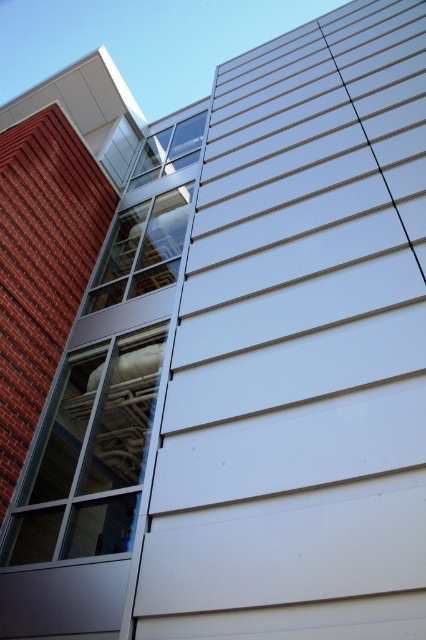
Between red brick siding at left and clear glass window at center-left, which one is positioned higher?

Positioned higher is clear glass window at center-left.

Between red brick siding at left and clear glass window at center-left, which one is positioned lower?

red brick siding at left is lower down.

Image resolution: width=426 pixels, height=640 pixels. In order to click on red brick siding at left in this screenshot , I will do `click(42, 266)`.

Image resolution: width=426 pixels, height=640 pixels. I want to click on red brick siding at left, so (42, 266).

Measure the distance from clear glass window at center-left to clear glass window at upper center.

clear glass window at center-left and clear glass window at upper center are 2.26 meters apart from each other.

Does point (112, 292) come farther from viewer compared to point (189, 132)?

No, it is in front of (189, 132).

You are a GUI agent. You are given a task and a screenshot of the screen. Output one action in this format:
    pyautogui.click(x=<x>, y=<y>)
    Task: Click on the clear glass window at center-left
    The height and width of the screenshot is (640, 426).
    Given the screenshot: What is the action you would take?
    pyautogui.click(x=141, y=250)

Is the position of clear glass window at center more distant than that of clear glass window at center-left?

No, clear glass window at center is closer to the viewer.

Who is more distant from viewer, [134,346] or [127,276]?

Positioned behind is point [127,276].

Identify the location of clear glass window at center. This screenshot has height=640, width=426. (89, 456).